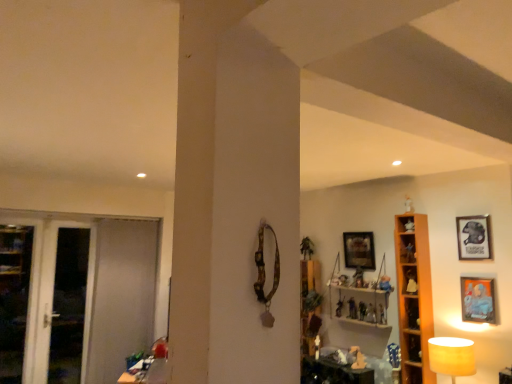
Question: From a real-world perspective, is matte wooden picture frame at right, positioned as the second picture frame in right-to-left order, under translucent plastic figurine at center-right, acting as the 3th toy starting from the top?

Choices:
 (A) no
 (B) yes

Answer: (A)

Question: Is matte wooden picture frame at right, positioned as the second picture frame in right-to-left order, positioned behind translucent plastic figurine at center-right, the fourth toy in the back-to-front sequence?

Choices:
 (A) no
 (B) yes

Answer: (A)

Question: Is matte wooden picture frame at right, positioned as the second picture frame in right-to-left order, facing away from translucent plastic figurine at center-right, acting as the 4th toy starting from the left?

Choices:
 (A) yes
 (B) no

Answer: (B)

Question: Is matte wooden picture frame at right, the third picture frame in the back-to-front sequence, oriented towards translucent plastic figurine at center-right, the fourth toy in the back-to-front sequence?

Choices:
 (A) yes
 (B) no

Answer: (B)

Question: Considering the relative sizes of matte wooden picture frame at right, the first picture frame in the front-to-back sequence, and translucent plastic figurine at center-right, which ranks as the 4th toy in bottom-to-top order, in the image provided, is matte wooden picture frame at right, the first picture frame in the front-to-back sequence, shorter than translucent plastic figurine at center-right, which ranks as the 4th toy in bottom-to-top order,?

Choices:
 (A) yes
 (B) no

Answer: (B)

Question: Does matte wooden picture frame at right, the second picture frame viewed from the left, lie in front of translucent plastic figurine at center-right, the fourth toy in the back-to-front sequence?

Choices:
 (A) no
 (B) yes

Answer: (B)

Question: From a real-world perspective, is translucent plastic figurine at center-right, which ranks as the 4th toy in bottom-to-top order, physically above matte plastic toy at center, which is counted as the 4th toy, starting from the front?

Choices:
 (A) no
 (B) yes

Answer: (A)

Question: Is translucent plastic figurine at center-right, acting as the 3th toy starting from the top, with matte plastic toy at center, arranged as the 3th toy when viewed from the back?

Choices:
 (A) no
 (B) yes

Answer: (B)

Question: Is matte plastic toy at center, which is counted as the 4th toy, starting from the front, surrounded by translucent plastic figurine at center-right, acting as the 3th toy starting from the top?

Choices:
 (A) no
 (B) yes

Answer: (A)

Question: From the image's perspective, does translucent plastic figurine at center-right, acting as the 3th toy starting from the top, appear higher than matte plastic toy at center, arranged as the fourth toy when viewed from the right?

Choices:
 (A) no
 (B) yes

Answer: (B)

Question: Is translucent plastic figurine at center-right, acting as the 3th toy starting from the top, looking in the opposite direction of matte plastic toy at center, arranged as the fourth toy when viewed from the right?

Choices:
 (A) no
 (B) yes

Answer: (A)

Question: Can you confirm if translucent plastic figurine at center-right, placed as the third toy when sorted from front to back, is bigger than matte plastic toy at center, which is the 3th toy in bottom-to-top order?

Choices:
 (A) yes
 (B) no

Answer: (A)

Question: Is wooden cabinet at left, which is counted as the 1th cabinet, starting from the bottom, bigger than matte wooden picture frame at right, positioned as the second picture frame in right-to-left order?

Choices:
 (A) yes
 (B) no

Answer: (A)